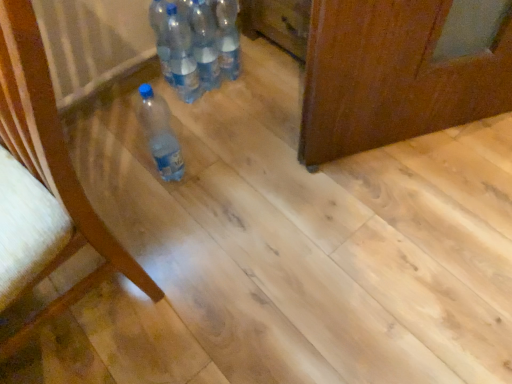
Find the location of a particular element. This screenshot has height=384, width=512. free point below matte wood chair at left (from a real-world perspective) is located at coordinates (77, 312).